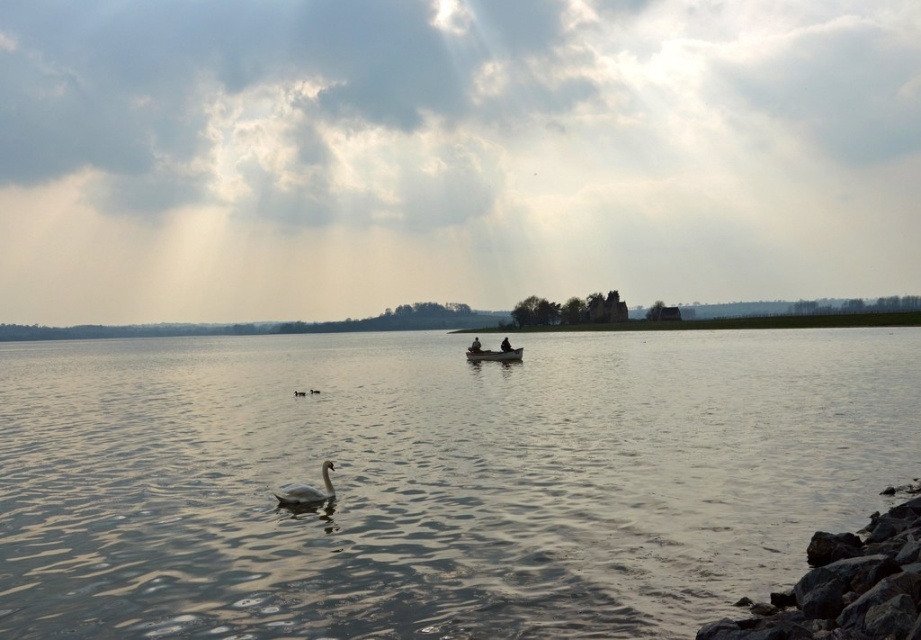
Question: Among these objects, which one is farthest from the camera?

Choices:
 (A) wooden boat at center
 (B) black matte boat at center
 (C) black matte person at center
 (D) clear water at center

Answer: (B)

Question: Estimate the real-world distances between objects in this image. Which object is farther from the black matte person at center?

Choices:
 (A) black matte boat at center
 (B) white glossy swan at lower center
 (C) clear water at center

Answer: (B)

Question: Is the position of clear water at center less distant than that of black matte person at center?

Choices:
 (A) no
 (B) yes

Answer: (B)

Question: Which point is farther to the camera?

Choices:
 (A) white glossy swan at lower center
 (B) wooden boat at center
 (C) clear water at center
 (D) black matte boat at center

Answer: (D)

Question: Does clear water at center have a larger size compared to wooden boat at center?

Choices:
 (A) yes
 (B) no

Answer: (A)

Question: Is clear water at center behind wooden boat at center?

Choices:
 (A) yes
 (B) no

Answer: (B)